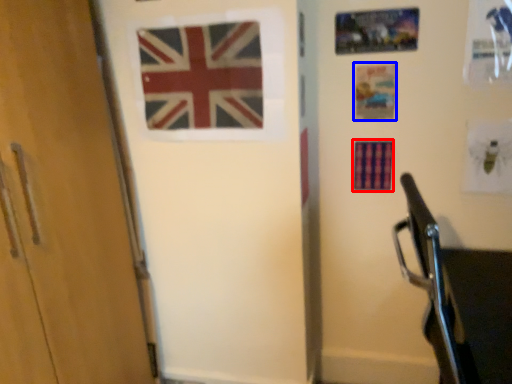
Question: Which object is further to the camera taking this photo, flag (highlighted by a red box) or postcard (highlighted by a blue box)?

Choices:
 (A) flag
 (B) postcard

Answer: (A)